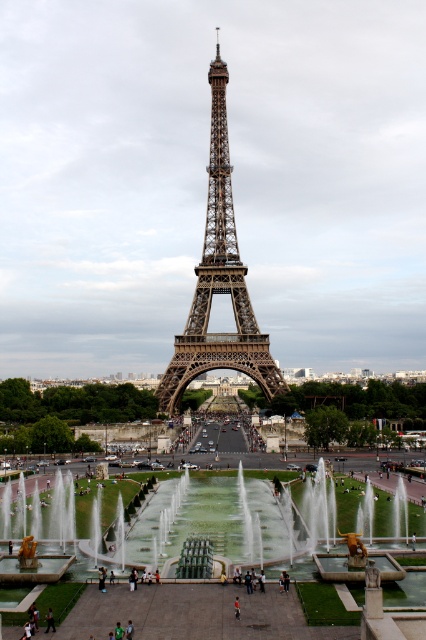
You are standing in the foreground of the image, looking towards the brown metal Eiffel Tower at center and the dark blue jeans at center. Which object is higher in your field of view?

The brown metal Eiffel Tower at center is located above the dark blue jeans at center, so it is higher in your field of view.

You are a tourist visiting the Eiffel Tower and want to take a photo that shows both the brown metal Eiffel Tower at center and the dark blue jeans at center. Since you want the Eiffel Tower to be the main focus, which object should appear larger in your photo?

The brown metal Eiffel Tower at center should appear larger in the photo because it is larger in size than the dark blue jeans at center, making it the main focus.

You are a photographer standing at the fountain in front of the Eiffel Tower. You want to take a photo that includes both the brown metal Eiffel Tower at center and the dark blue jeans at center. Which object will appear larger in the photo?

The brown metal Eiffel Tower at center will appear larger in the photo because it is much taller than the dark blue jeans at center.